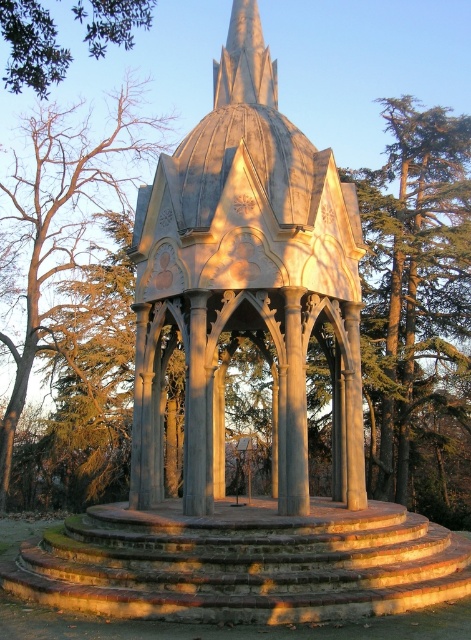
In the scene shown: You are standing at the coordinates 0.5, 0.5 in the image. Which direction should you move to reach the stone gazebo at center?

The stone gazebo at center is located at point (245, 280), so you should move slightly to the left and down from your current position at (235, 320) to reach it.